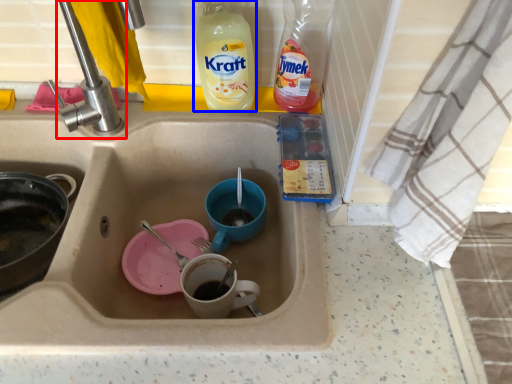
Question: Which object is further to the camera taking this photo, tap (highlighted by a red box) or drink (highlighted by a blue box)?

Choices:
 (A) tap
 (B) drink

Answer: (B)